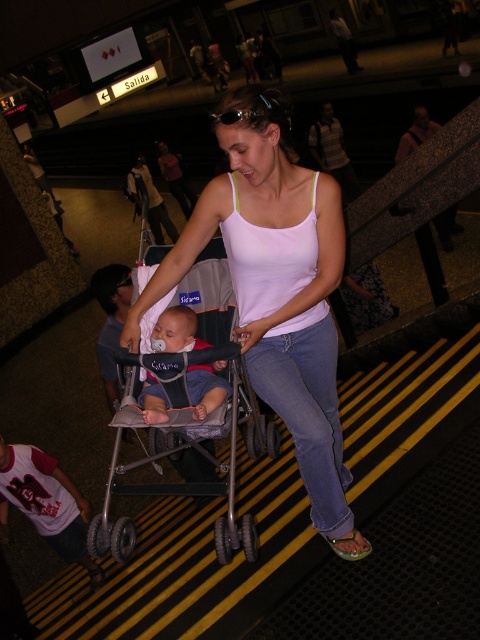
You are a delivery robot with a 20 inch wide package. You need to navigate through the subway station and pass between the white cotton tank top at center and the gray fabric stroller at center. Will your package fit through the space between them?

The distance between the white cotton tank top at center and the gray fabric stroller at center is 21.64 inches. Since your package is 20 inches wide, it should fit through the space as there is enough clearance.

You are a photographer standing at the subway station. You want to take a photo of the white cotton tank top at center and the soft blue fabric baby at center. Which object should you focus on first if you want to capture both in the same frame without moving the camera?

Since the white cotton tank top at center is taller than the soft blue fabric baby at center, you should focus on the white cotton tank top at center first to ensure it fits within the frame.

You are a photographer taking a picture of the scene. You notice the white cotton tank top at center and the gray fabric stroller at center. Which object will appear larger in the photo if you focus on the center?

The white cotton tank top at center will appear larger in the photo because it has a greater height compared to the gray fabric stroller at center.